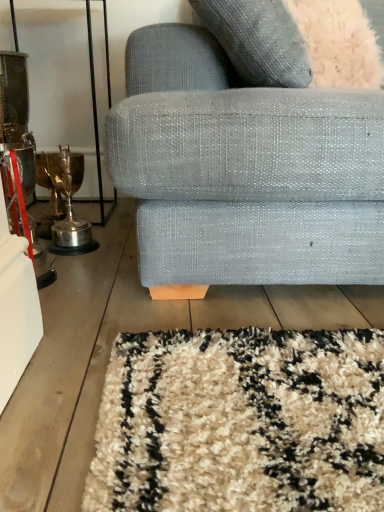
Question: Considering the positions of textured gray couch at center and fuzzy gray throw pillow at upper right in the image, is textured gray couch at center wider or thinner than fuzzy gray throw pillow at upper right?

Choices:
 (A) wide
 (B) thin

Answer: (A)

Question: Considering the positions of textured gray couch at center and fuzzy gray throw pillow at upper right in the image, is textured gray couch at center taller or shorter than fuzzy gray throw pillow at upper right?

Choices:
 (A) tall
 (B) short

Answer: (A)

Question: Based on their positions, is textured gray couch at center located to the left or right of fuzzy gray throw pillow at upper right?

Choices:
 (A) right
 (B) left

Answer: (B)

Question: Considering the positions of point (251, 35) and point (266, 112), is point (251, 35) closer or farther from the camera than point (266, 112)?

Choices:
 (A) closer
 (B) farther

Answer: (B)

Question: Relative to textured gray couch at center, is fuzzy gray throw pillow at upper right in front or behind?

Choices:
 (A) front
 (B) behind

Answer: (B)

Question: In terms of size, does fuzzy gray throw pillow at upper right appear bigger or smaller than textured gray couch at center?

Choices:
 (A) small
 (B) big

Answer: (A)

Question: In terms of width, does fuzzy gray throw pillow at upper right look wider or thinner when compared to textured gray couch at center?

Choices:
 (A) thin
 (B) wide

Answer: (A)